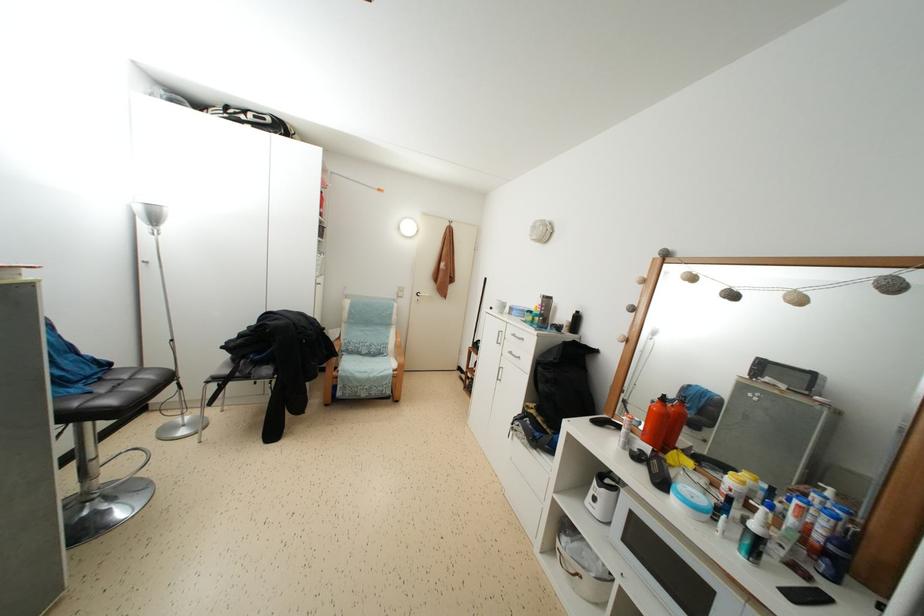
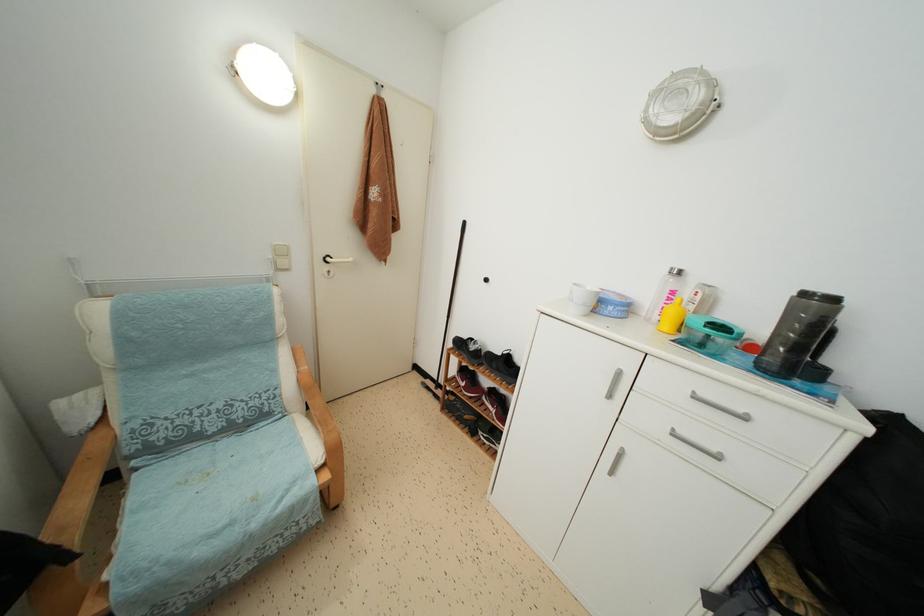
Find the pixel in the second image that matches point 517,341 in the first image.

(699, 402)